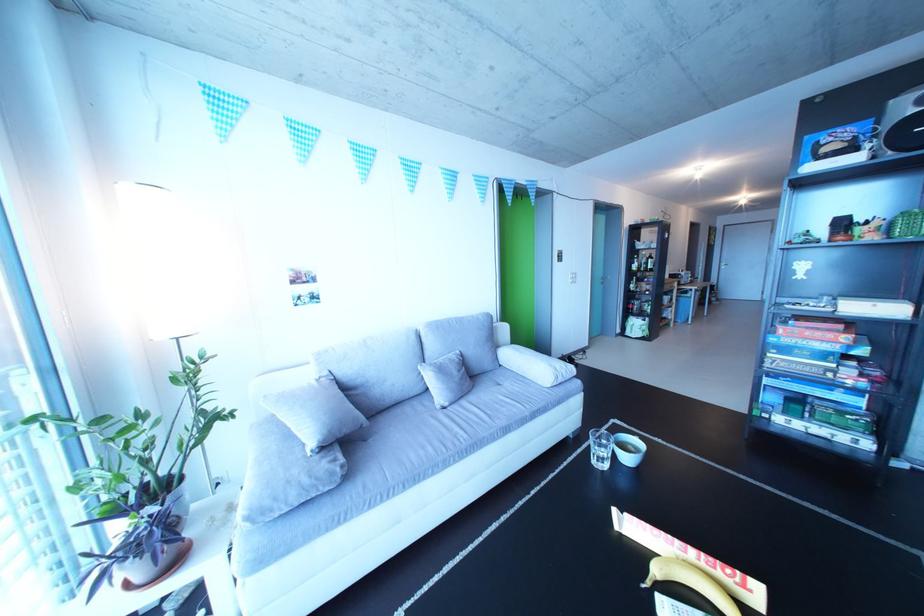
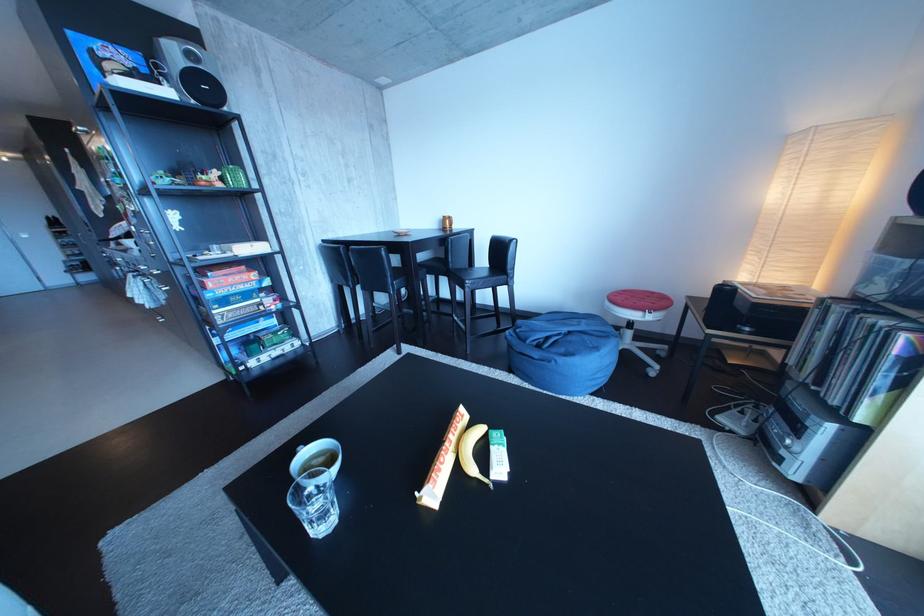
Where in the second image is the point corresponding to point (785, 345) from the first image?

(223, 301)